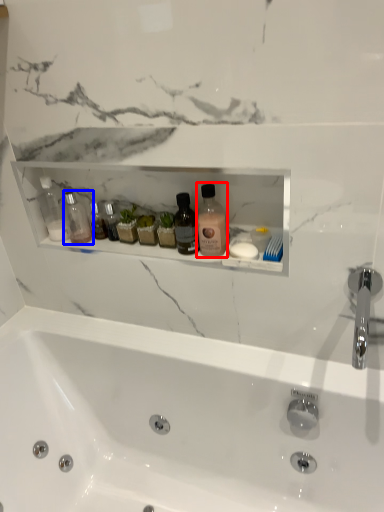
Question: Which object appears farthest to the camera in this image, cleaning product (highlighted by a red box) or toiletry (highlighted by a blue box)?

Choices:
 (A) cleaning product
 (B) toiletry

Answer: (B)